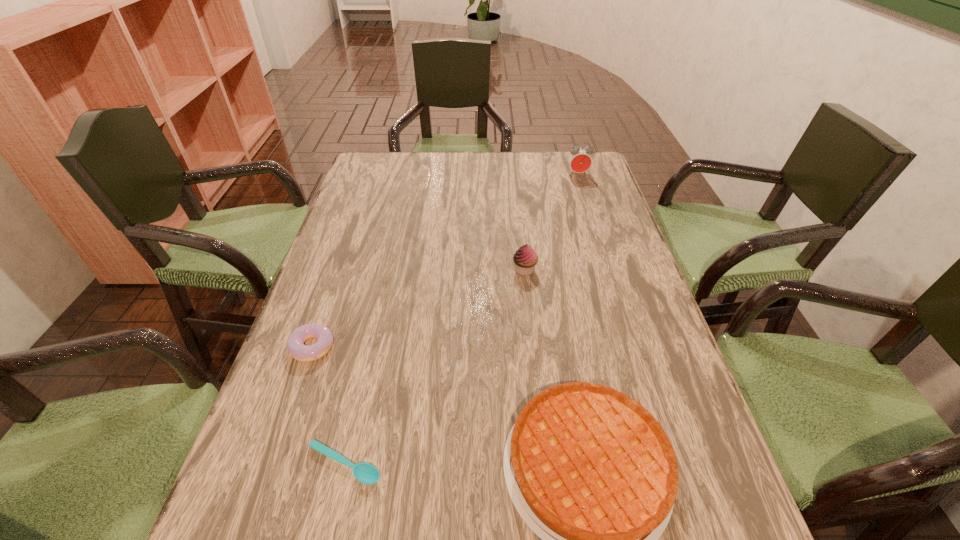
Identify the location of the farthest object. (579, 159).

Find the location of `the tallest object`. the tallest object is located at coordinates (579, 159).

Where is `the second farthest object`? the second farthest object is located at coordinates (525, 258).

At what (x,y) coordinates should I click in order to perform the action: click on the second tallest object. Please return your answer as a coordinate pair (x, y). Image resolution: width=960 pixels, height=540 pixels. Looking at the image, I should click on (525, 258).

At what (x,y) coordinates should I click in order to perform the action: click on the leftmost object. Please return your answer as a coordinate pair (x, y). The width and height of the screenshot is (960, 540). Looking at the image, I should click on (295, 344).

Where is `doughnut`? This screenshot has width=960, height=540. doughnut is located at coordinates (295, 344).

The height and width of the screenshot is (540, 960). Identify the location of the fourth object from right to left. (365, 473).

The width and height of the screenshot is (960, 540). In order to click on spoon in this screenshot , I will do `click(365, 473)`.

The width and height of the screenshot is (960, 540). Identify the location of free space located on the face of the farthest object. (589, 212).

Find the location of a particular element. The image size is (960, 540). vacant space located 0.150m on the left of the fourth nearest object is located at coordinates (454, 270).